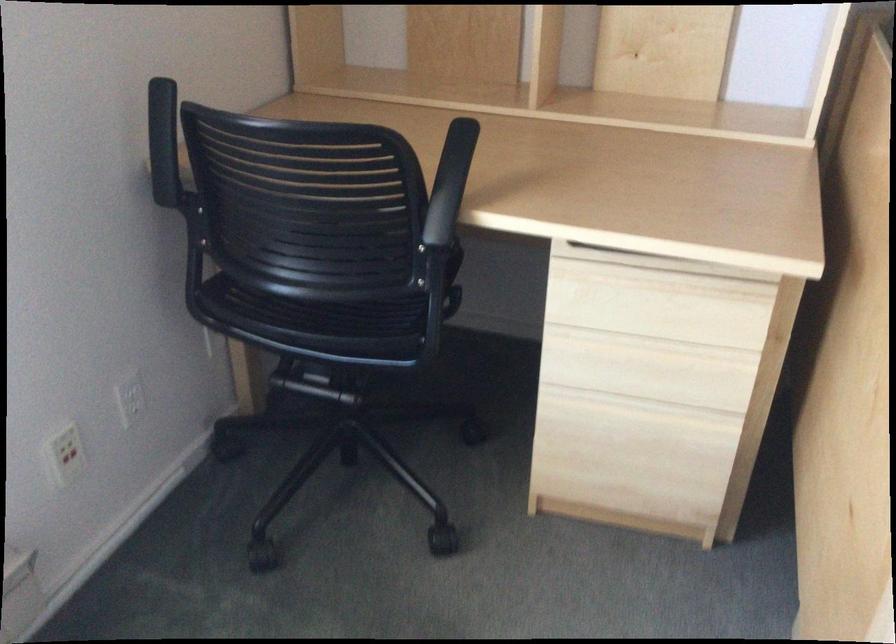
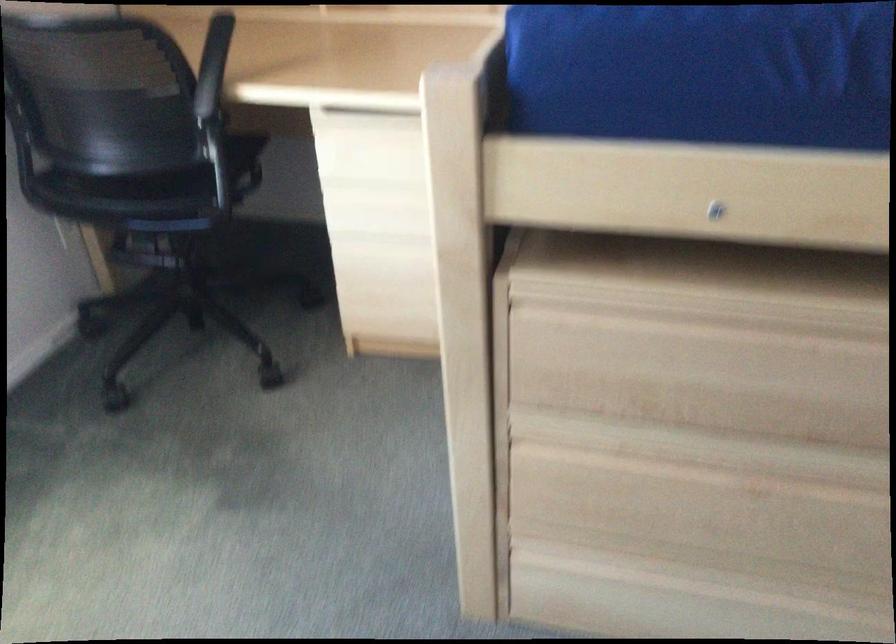
Find the pixel in the second image that matches [451,189] in the first image.

(212, 66)